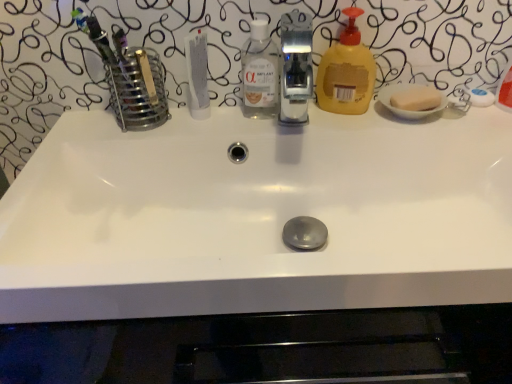
Where is `free space that is to the left of yellow translucent liquid soap at right`? free space that is to the left of yellow translucent liquid soap at right is located at coordinates (245, 121).